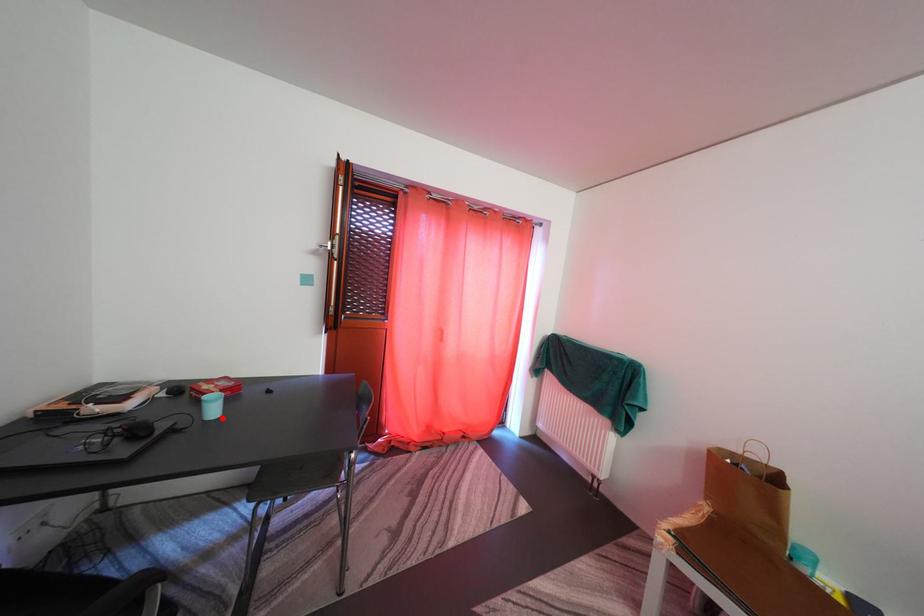
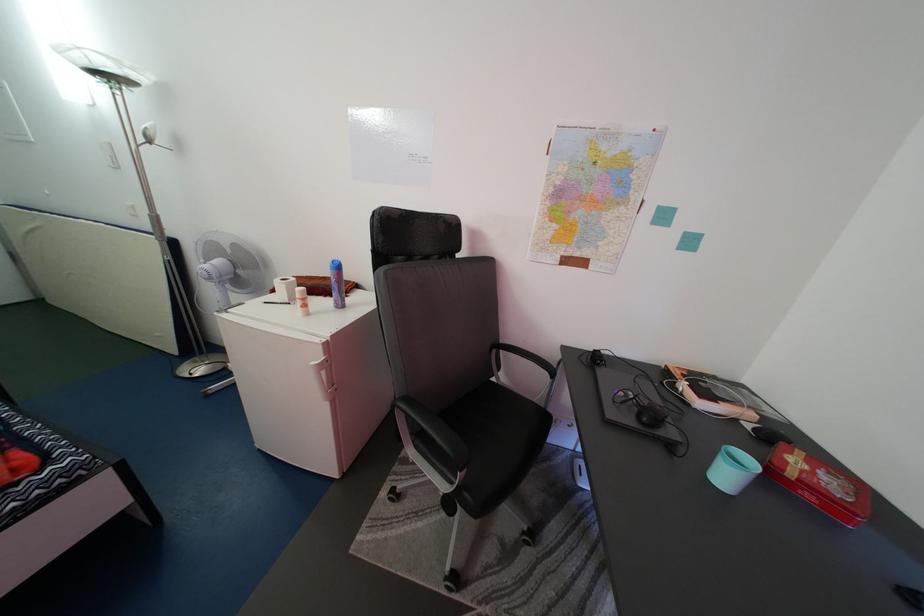
In the second image, find the point that corresponds to the highlighted location in the first image.

(735, 484)